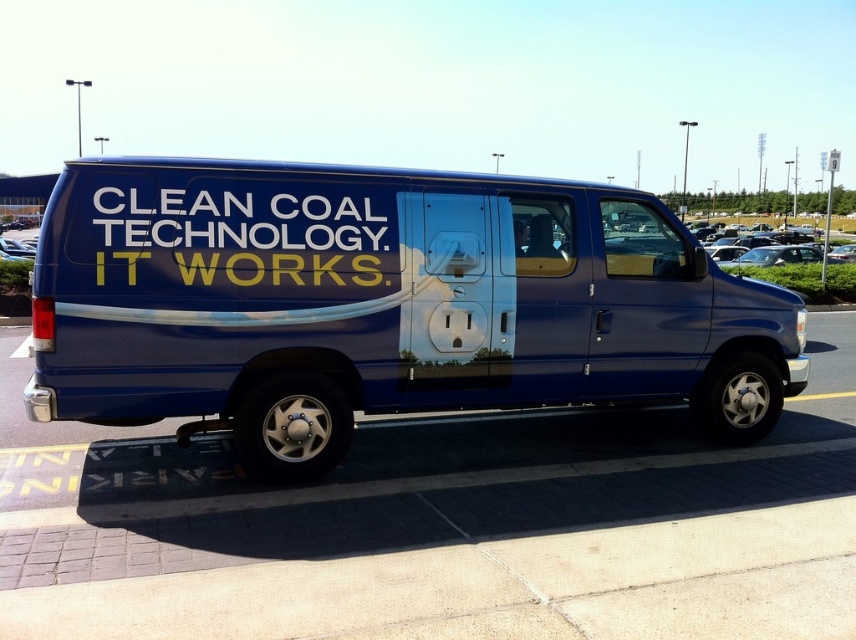
Question: Which point is farther to the camera?

Choices:
 (A) (421, 323)
 (B) (351, 244)

Answer: (A)

Question: Among these objects, which one is farthest from the camera?

Choices:
 (A) blue metallic van at center
 (B) whitematerial/texturetext at side

Answer: (A)

Question: Considering the relative positions of blue metallic van at center and whitematerial/texturetext at side in the image provided, where is blue metallic van at center located with respect to whitematerial/texturetext at side?

Choices:
 (A) left
 (B) right

Answer: (B)

Question: Does blue metallic van at center have a larger size compared to whitematerial/texturetext at side?

Choices:
 (A) no
 (B) yes

Answer: (A)

Question: Can you confirm if blue metallic van at center is bigger than whitematerial/texturetext at side?

Choices:
 (A) yes
 (B) no

Answer: (B)